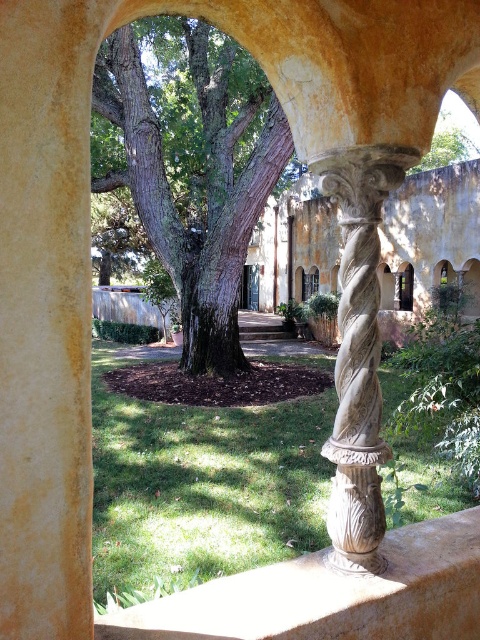
From the picture: You are standing in the courtyard and want to take a photo of the carved stone column at center and the green leafy tree at upper center. Which object should you focus on first if you want to capture both in a single frame without moving your camera?

The carved stone column at center is smaller than the green leafy tree at upper center, so you should focus on the carved stone column at center first to ensure it is in frame before adjusting the camera angle to include the larger green leafy tree at upper center.

You are standing in the courtyard and want to take a photo of the green rough bark tree at center and the carved stone column at center. If you face the building in the background, which object will be to your left?

The green rough bark tree at center is positioned on the left side of carved stone column at center. So, when facing the building, the green rough bark tree at center will be to your left.